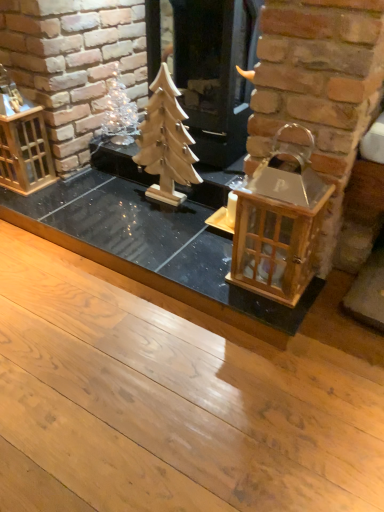
Question: Is point (259, 164) closer or farther from the camera than point (218, 125)?

Choices:
 (A) closer
 (B) farther

Answer: (A)

Question: Considering the positions of wooden lantern at right and wooden christmas tree at center in the image, is wooden lantern at right bigger or smaller than wooden christmas tree at center?

Choices:
 (A) big
 (B) small

Answer: (B)

Question: Which object is positioned closest to the wooden lantern at right?

Choices:
 (A) wooden christmas tree at center
 (B) wooden lantern at left
 (C) wooden christmas tree at center
 (D) clear glass ornament at upper left

Answer: (C)

Question: Based on their relative distances, which object is farther from the wooden christmas tree at center?

Choices:
 (A) wooden lantern at left
 (B) wooden christmas tree at center
 (C) wooden lantern at right
 (D) clear glass ornament at upper left

Answer: (C)